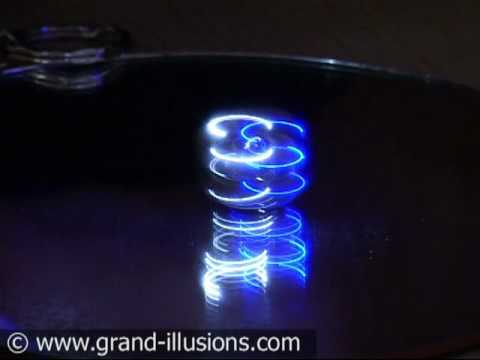
Find the location of `surface`. surface is located at coordinates (48, 262).